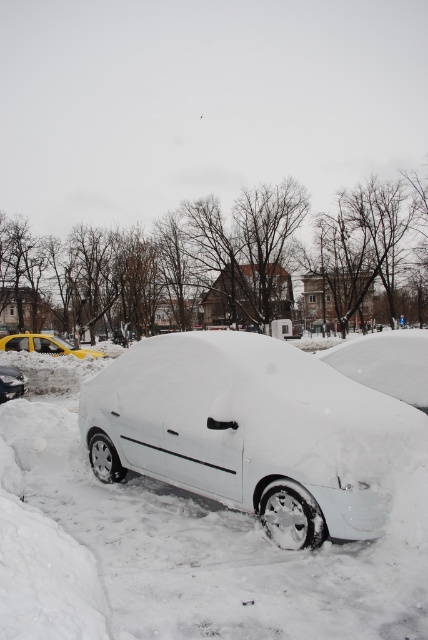
Question: Does yellow matte taxi at left appear on the left side of white matte car at lower left?

Choices:
 (A) yes
 (B) no

Answer: (A)

Question: Does yellow matte taxi at left come in front of white matte car at lower left?

Choices:
 (A) no
 (B) yes

Answer: (A)

Question: Which point is closer to the camera?

Choices:
 (A) yellow matte taxi at left
 (B) white matte car at center
 (C) white matte car at lower left

Answer: (B)

Question: Does white matte car at center appear on the left side of white matte car at lower left?

Choices:
 (A) no
 (B) yes

Answer: (A)

Question: Among these points, which one is farthest from the camera?

Choices:
 (A) (127, 364)
 (B) (20, 333)
 (C) (18, 376)

Answer: (B)

Question: Which point is closer to the camera?

Choices:
 (A) (5, 340)
 (B) (195, 378)

Answer: (B)